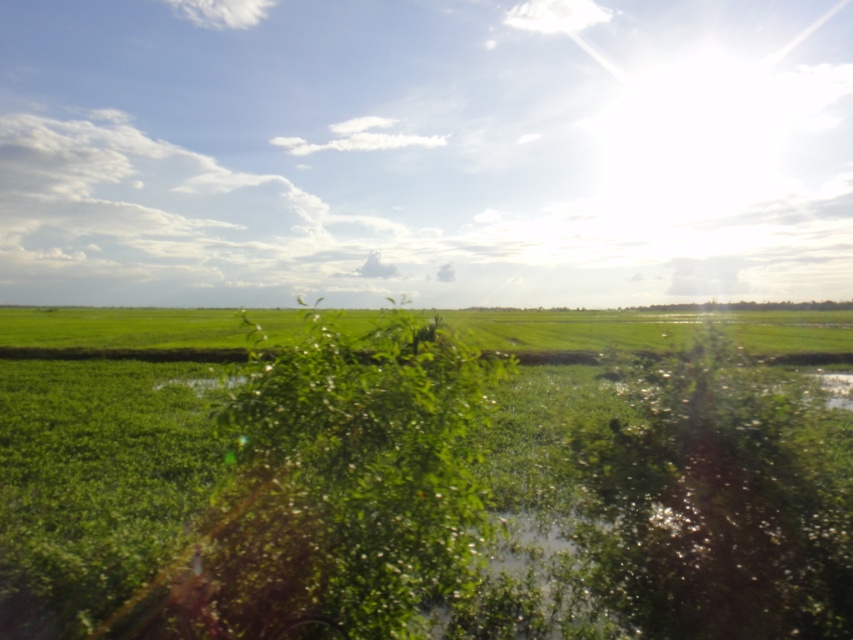
You are standing in the middle of the green fields and see two points in the distance. The first point is at coordinate point(624, 493) and the second is at point(596, 472). Which point is closer to you?

Point(624, 493) is in front of point(596, 472), so it is closer to you.

You are a photographer trying to capture a shot of the green grassy wetland at center and the green leafy plant at center. From your current position, which one is more to the left?

The green grassy wetland at center is positioned on the left side of green leafy plant at center, so it is more to the left.

You are a photographer aiming to capture the entire green grassy wetland at center and green leafy plant at center in a single frame. Which object requires more horizontal space in the composition?

The green grassy wetland at center requires more horizontal space in the composition because its width surpasses that of the green leafy plant at center.